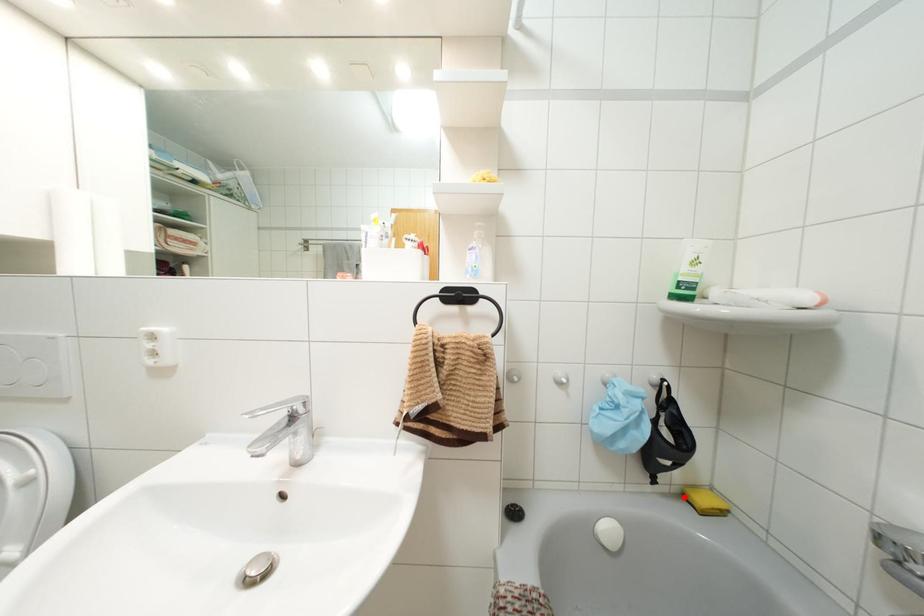
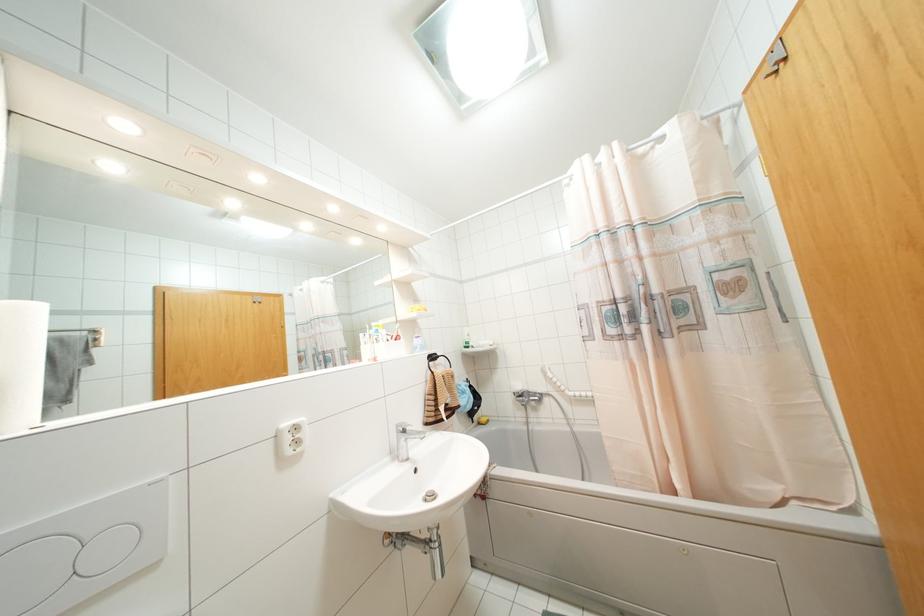
Question: I am providing you with two images of the same scene from different viewpoints. A red point is shown in image1. For the corresponding object point in image2, is it positioned nearer or farther from the camera?

Choices:
 (A) Nearer
 (B) Farther

Answer: (B)